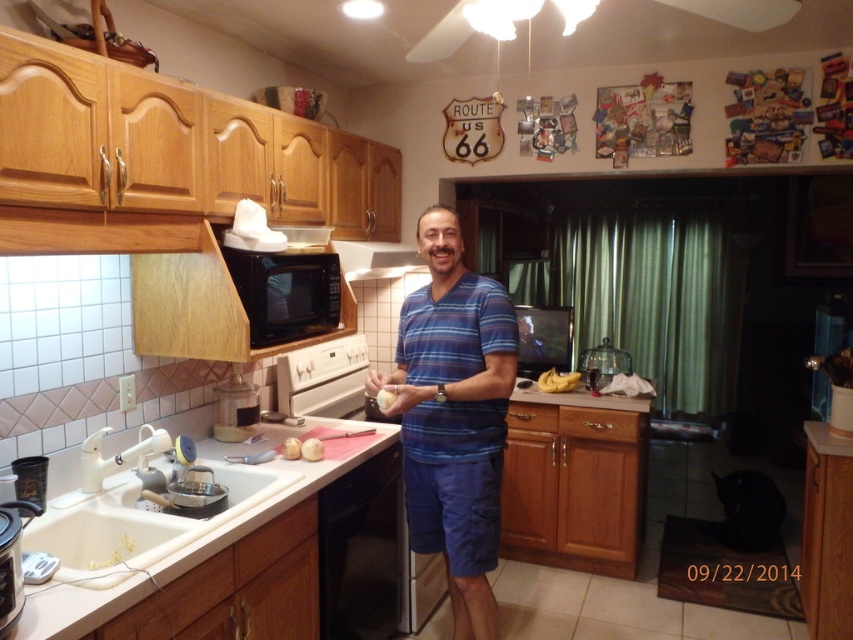
Between white glossy countertop at lower left and yellow matte bananas at center, which one appears on the right side from the viewer's perspective?

yellow matte bananas at center

Who is more forward, (254, 612) or (561, 385)?

Point (254, 612) is in front.

Who is more distant from viewer, [235,512] or [561,390]?

The point [561,390] is more distant.

Where is `white glossy countertop at lower left`? This screenshot has height=640, width=853. white glossy countertop at lower left is located at coordinates (189, 550).

Is black matte exhaust hood at upper center shorter than white matte onion at center?

No, black matte exhaust hood at upper center is not shorter than white matte onion at center.

Does point (368, 275) lie in front of point (380, 403)?

No, it is behind (380, 403).

The width and height of the screenshot is (853, 640). In order to click on black matte exhaust hood at upper center in this screenshot , I will do `click(375, 259)`.

Which is above, white glossy sink at lower left or white matte bread at lower center?

white matte bread at lower center is higher up.

Does white glossy sink at lower left have a smaller size compared to white matte bread at lower center?

Incorrect, white glossy sink at lower left is not smaller in size than white matte bread at lower center.

Who is more forward, (173, 538) or (300, 456)?

Point (173, 538) is in front.

Image resolution: width=853 pixels, height=640 pixels. I want to click on white glossy sink at lower left, so click(135, 524).